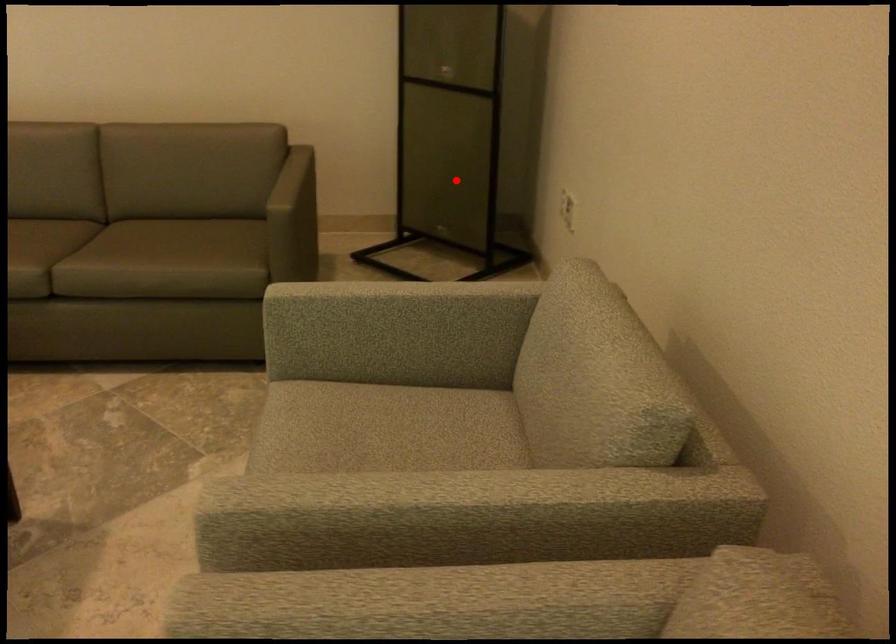
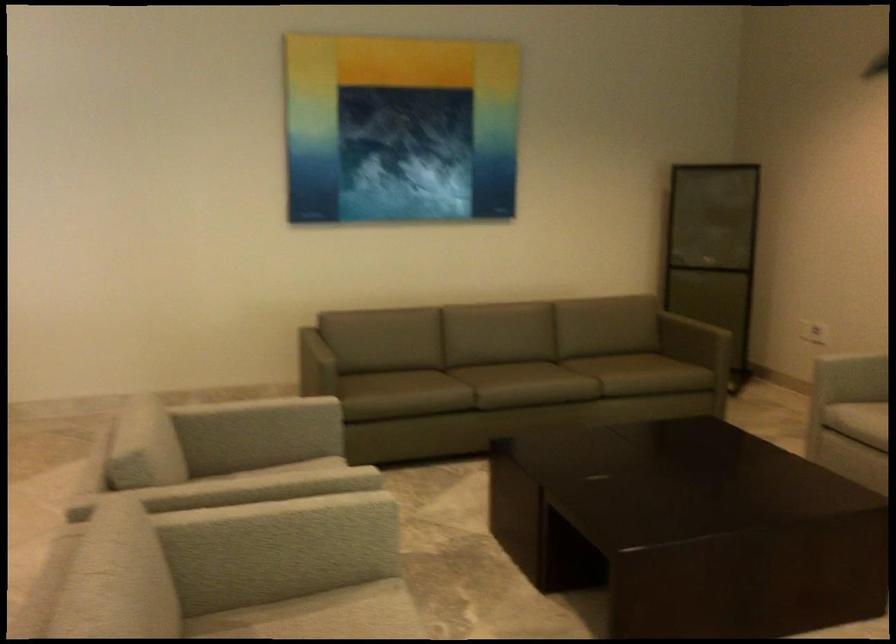
Question: I am providing you with two images of the same scene from different viewpoints. A red point is shown in image1. For the corresponding object point in image2, is it positioned nearer or farther from the camera?

Choices:
 (A) Nearer
 (B) Farther

Answer: (B)